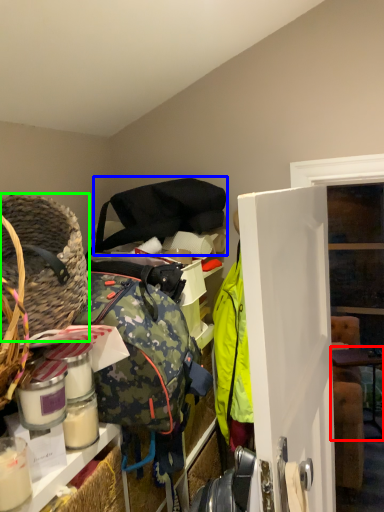
Question: Which is nearer to the table (highlighted by a red box)? shoulder bag (highlighted by a blue box) or basket (highlighted by a green box).

Choices:
 (A) shoulder bag
 (B) basket

Answer: (A)